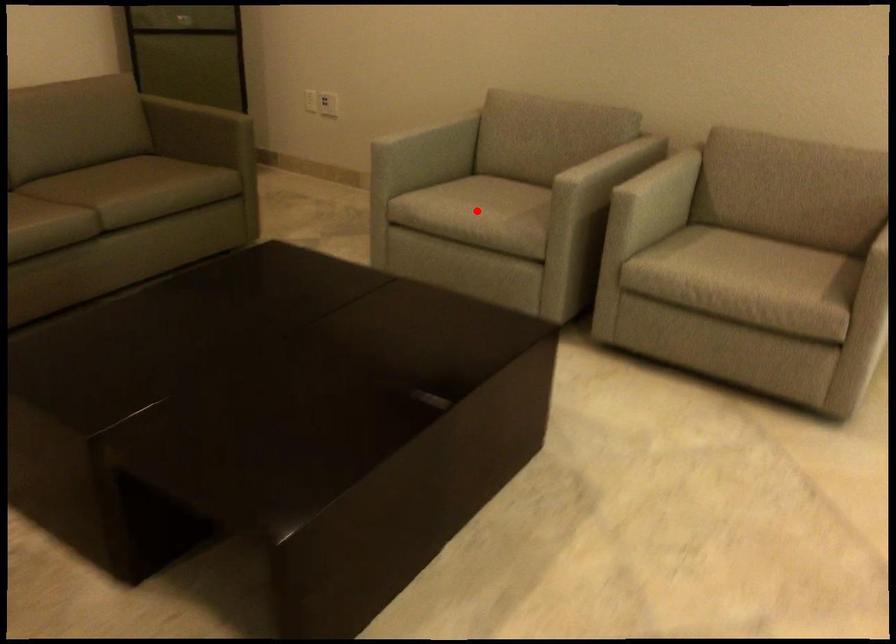
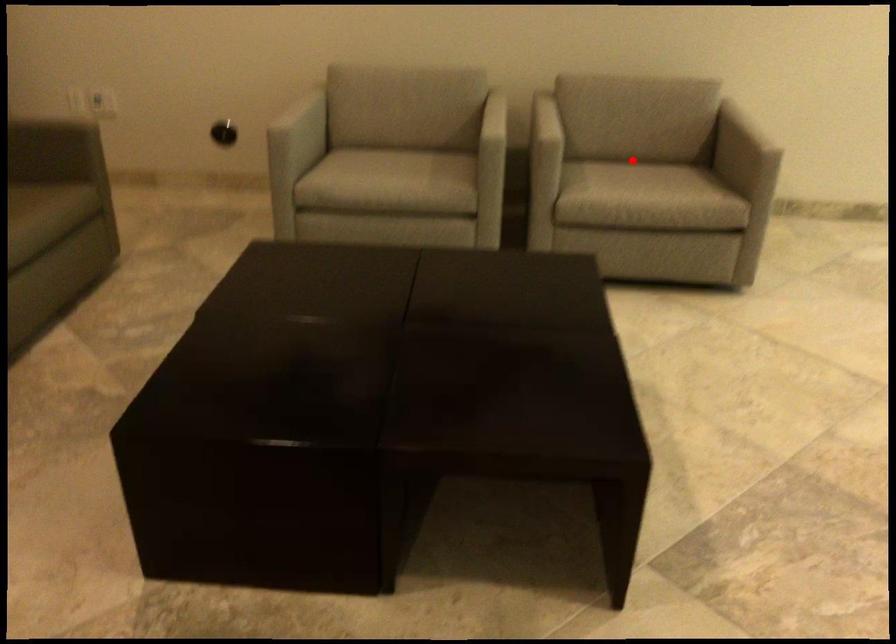
I am providing you with two images of the same scene from different viewpoints. A red point is marked on the first image and another point is marked on the second image. Is the marked point in image1 the same physical position as the marked point in image2?

No